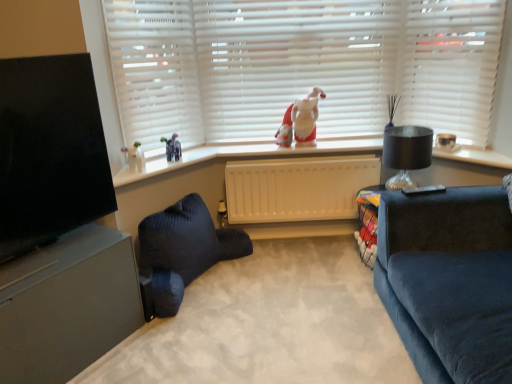
Find the location of a particular element. The image size is (512, 384). vacant space in front of dark blue fabric studio couch at lower center is located at coordinates (207, 343).